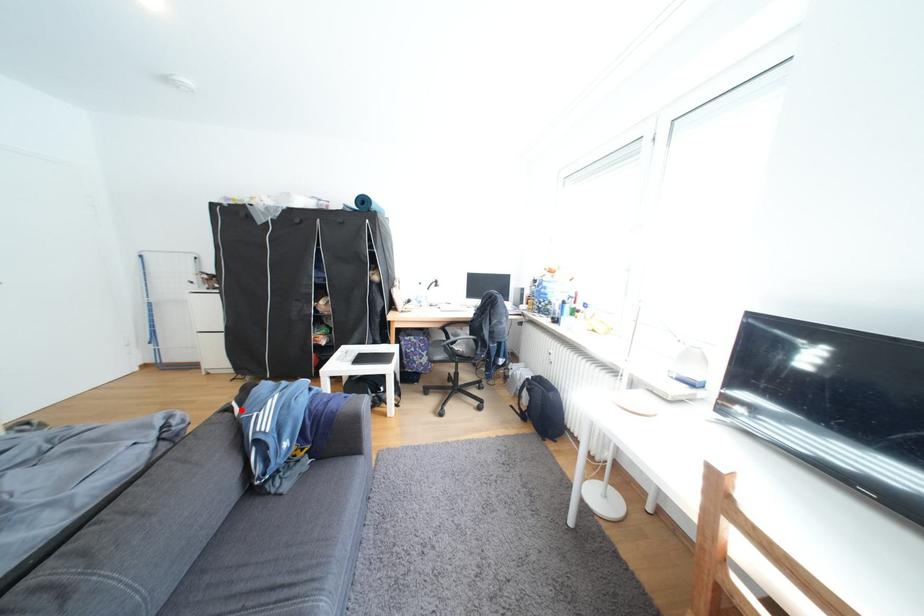
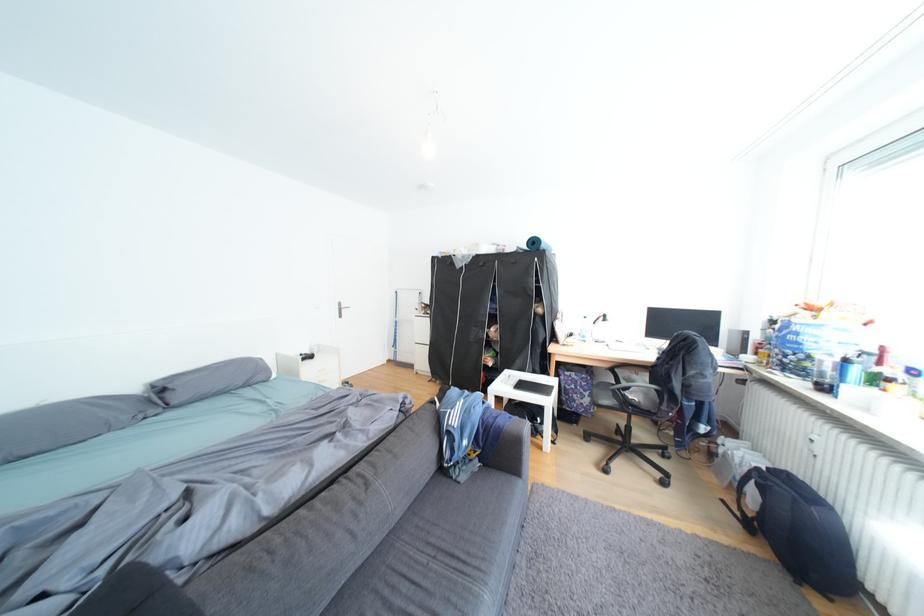
Where in the second image is the point corresponding to the highlighted location from the first image?

(446, 403)